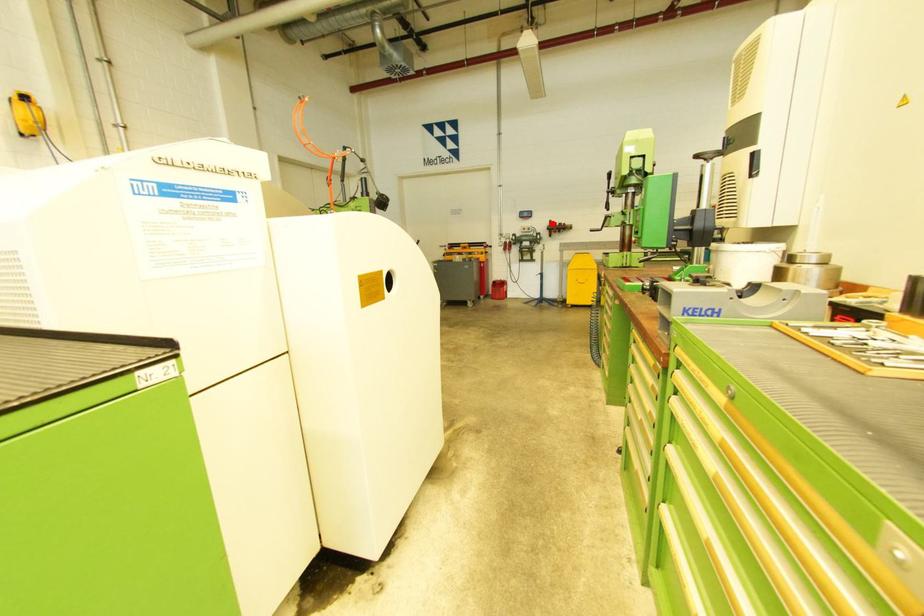
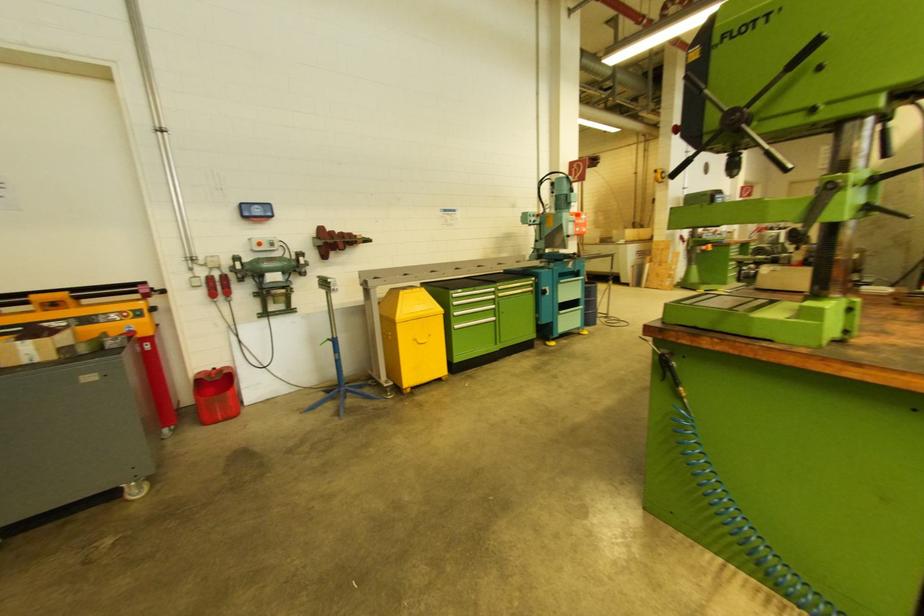
In the second image, find the point that corresponds to the highlighted location in the first image.

(323, 231)